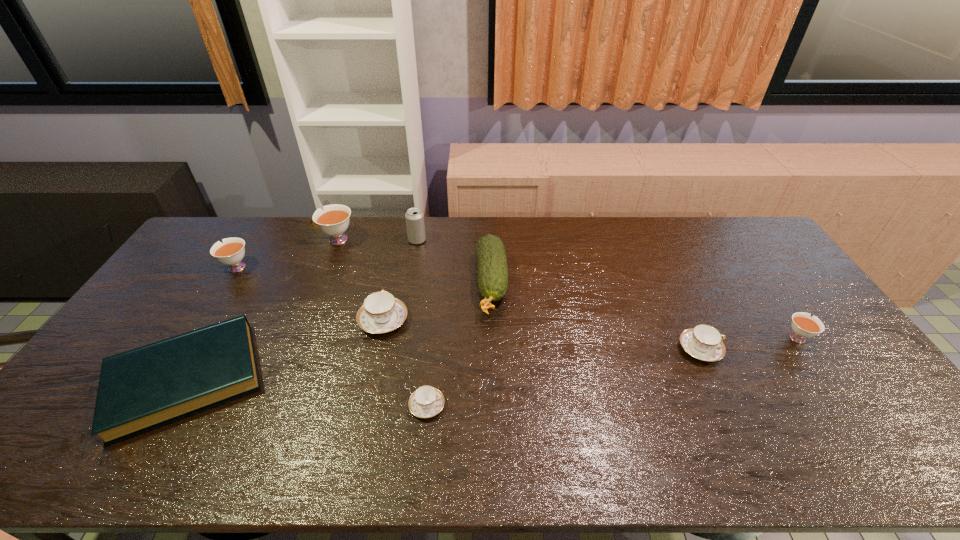
Where is `white beer can`? white beer can is located at coordinates (414, 217).

Image resolution: width=960 pixels, height=540 pixels. What are the coordinates of `the farthest teacup` in the screenshot? It's located at (334, 220).

Locate an element on the screen. The width and height of the screenshot is (960, 540). the farthest white teacup is located at coordinates (334, 220).

The image size is (960, 540). In order to click on green cucumber in this screenshot , I will do `click(492, 265)`.

At what (x,y) coordinates should I click in order to perform the action: click on the seventh object from left to right. Please return your answer as a coordinate pair (x, y). This screenshot has width=960, height=540. Looking at the image, I should click on (492, 265).

Identify the location of the second farthest teacup. The height and width of the screenshot is (540, 960). (230, 252).

You are a GUI agent. You are given a task and a screenshot of the screen. Output one action in this format:
    pyautogui.click(x=<x>, y=<y>)
    Task: Click on the second nearest white teacup
    This screenshot has height=540, width=960.
    Given the screenshot: What is the action you would take?
    pyautogui.click(x=230, y=252)

Image resolution: width=960 pixels, height=540 pixels. I want to click on the fourth teacup from right to left, so click(381, 312).

Find the location of a particular element. the leftmost blue teacup is located at coordinates (381, 312).

Where is `the rightmost teacup`? This screenshot has width=960, height=540. the rightmost teacup is located at coordinates (804, 326).